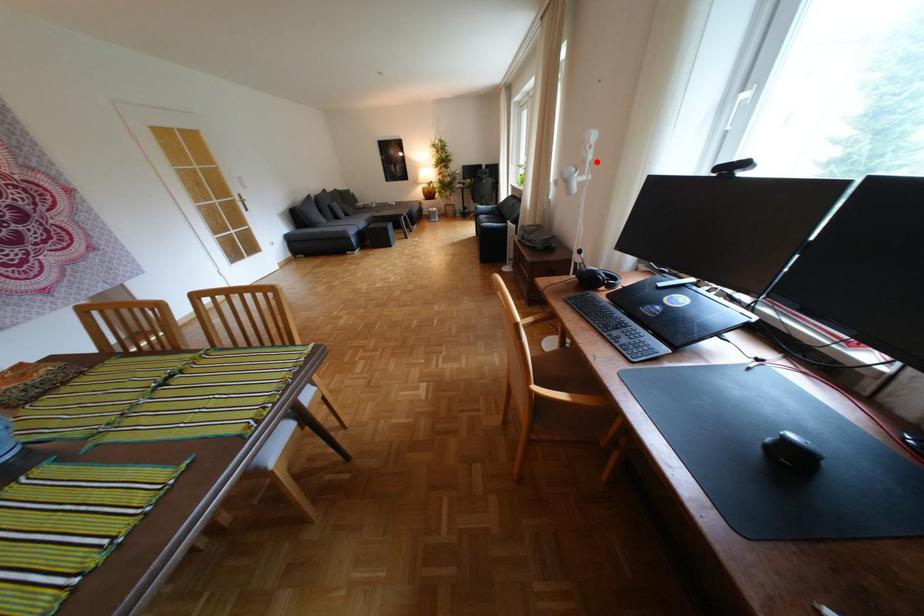
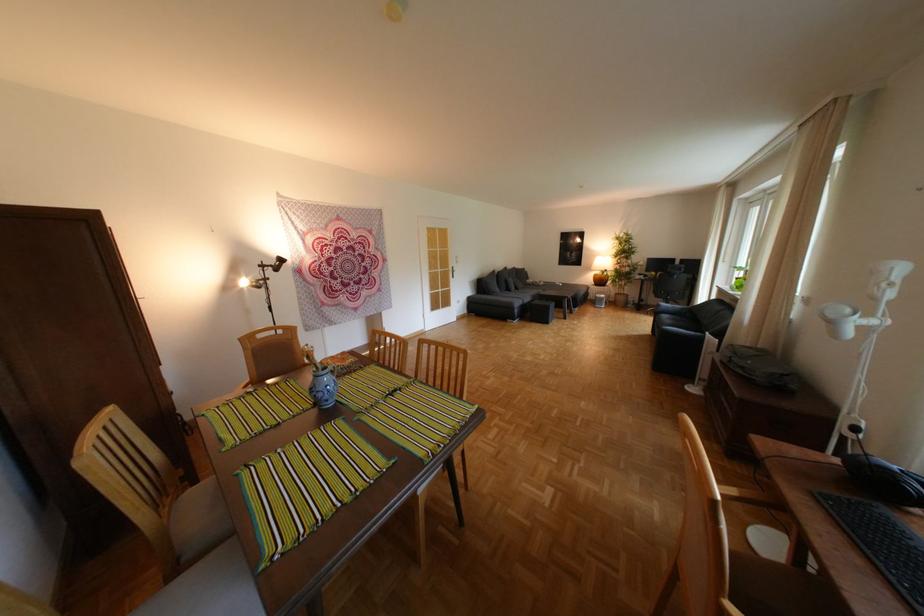
Locate, in the second image, the point that corresponds to the highlighted location in the first image.

(888, 299)